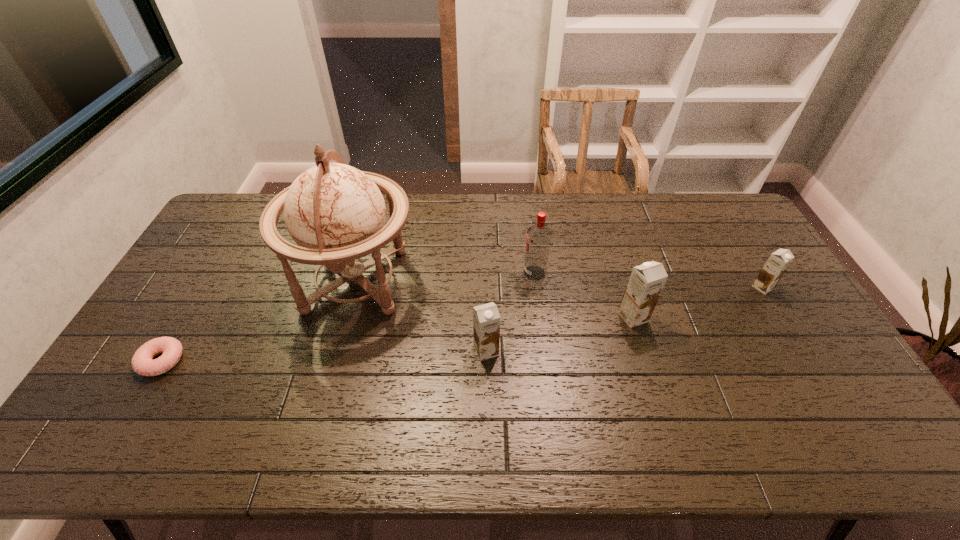
I want to click on the fifth object from right to left, so click(336, 213).

I want to click on free point located 0.100m on the right of the third shortest object, so click(x=535, y=350).

Locate an element on the screen. The image size is (960, 540). vacant space situated on the front of the second nearest chocolate milk is located at coordinates (654, 383).

You are a GUI agent. You are given a task and a screenshot of the screen. Output one action in this format:
    pyautogui.click(x=<x>, y=<y>)
    Task: Click on the vacant area situated on the front of the shortest chocolate milk
    This screenshot has width=960, height=540.
    Given the screenshot: What is the action you would take?
    pyautogui.click(x=811, y=367)

In order to click on free space located on the back of the leftmost object in this screenshot , I will do `click(210, 278)`.

This screenshot has width=960, height=540. I want to click on vacant space situated on the front label of the third object from right to left, so click(x=412, y=273).

Locate an element on the screen. free spot located 0.290m on the front label of the third object from right to left is located at coordinates (433, 273).

This screenshot has width=960, height=540. Find the location of `free region located 0.160m on the front label of the third object from right to left`. free region located 0.160m on the front label of the third object from right to left is located at coordinates (473, 273).

You are a GUI agent. You are given a task and a screenshot of the screen. Output one action in this format:
    pyautogui.click(x=<x>, y=<y>)
    Task: Click on the free region located on the front-facing side of the tallest object
    Image resolution: width=960 pixels, height=540 pixels.
    Given the screenshot: What is the action you would take?
    pyautogui.click(x=481, y=281)

Identify the location of object that is at the near edge. (142, 363).